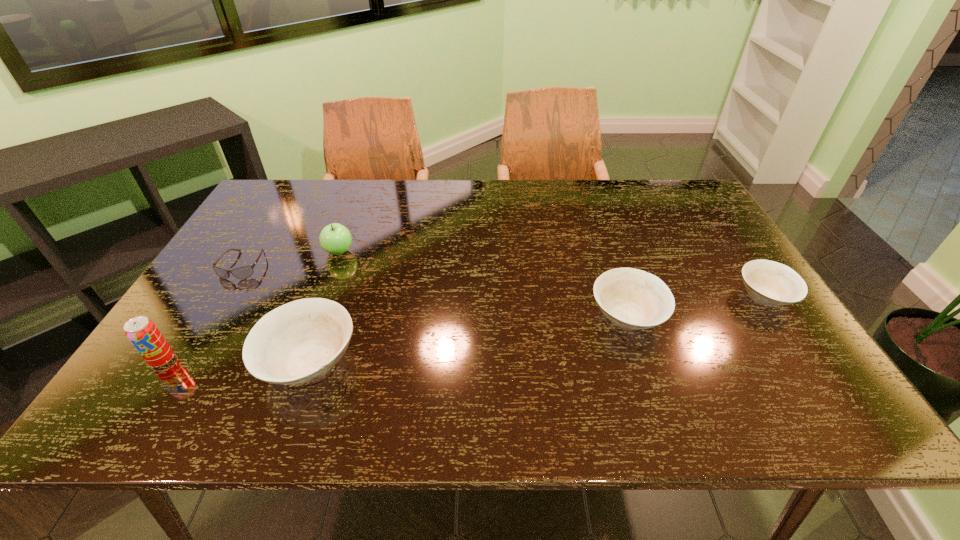
The image size is (960, 540). What are the coordinates of `the tallest bowl` in the screenshot? It's located at (298, 342).

Identify the location of the second object from right to left. 631,298.

The image size is (960, 540). Identify the location of the second tallest bowl. tap(631, 298).

In order to click on the rightmost object in this screenshot , I will do [768, 282].

You are a GUI agent. You are given a task and a screenshot of the screen. Output one action in this format:
    pyautogui.click(x=<x>, y=<y>)
    Task: Click on the fifth tallest object
    The image size is (960, 540).
    Given the screenshot: What is the action you would take?
    pyautogui.click(x=768, y=282)

Where is `apple`? The width and height of the screenshot is (960, 540). apple is located at coordinates (335, 239).

Locate an element on the screen. sunglasses is located at coordinates (244, 272).

The width and height of the screenshot is (960, 540). I want to click on the tallest object, so click(x=143, y=334).

Identify the location of vacant position located on the left of the tallest bowl. This screenshot has height=540, width=960. (168, 362).

Image resolution: width=960 pixels, height=540 pixels. Find the location of `free space located 0.150m on the back of the second object from right to left`. free space located 0.150m on the back of the second object from right to left is located at coordinates (606, 254).